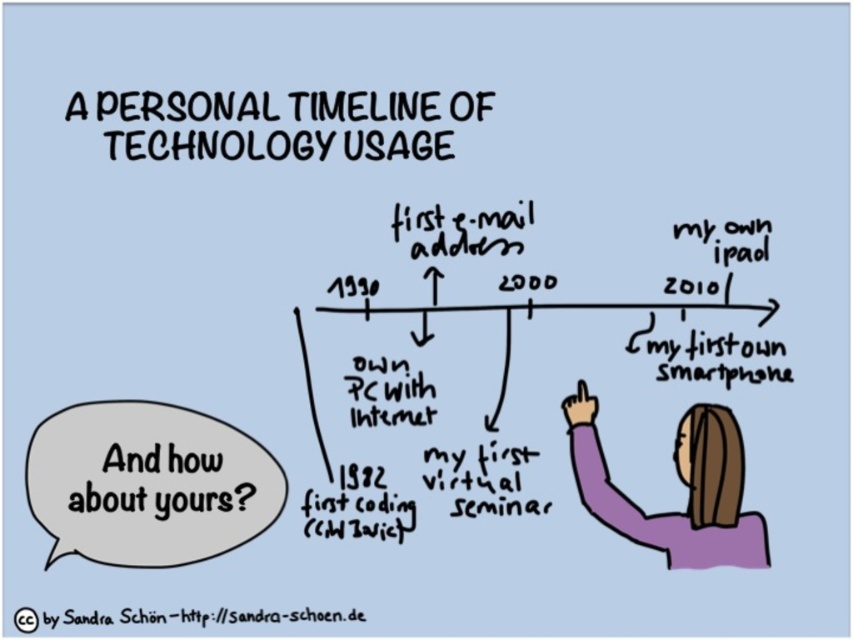
You are an artist reviewing a digital painting of a personal timeline. The image includes a purple fabric shirt at upper right and black handwritten text at center. Based on the scene, can you determine which object is wider?

The purple fabric shirt at upper right is wider than the black handwritten text at center.

You are a designer creating a poster and need to place the gray paper speech bubble at lower left and the purple fabric shirt at upper right. The minimum required distance between them is 30 centimeters to ensure readability. Based on the image, will the current placement meet this requirement?

The gray paper speech bubble at lower left and purple fabric shirt at upper right are 35.81 centimeters apart, which exceeds the minimum required distance of 30 centimeters. Therefore, the current placement meets the readability requirement.

You are looking at the timeline and want to determine which point is nearer to you. The points are labeled as point 1 at coordinates (688,419) and point 2 at (384,492). Which point is closer to your viewpoint?

Point 1 at coordinates (688,419) is closer to the camera than point 2 at (384,492), so point 1 is closer to your viewpoint.